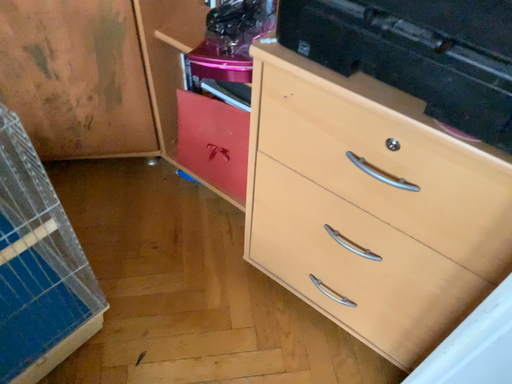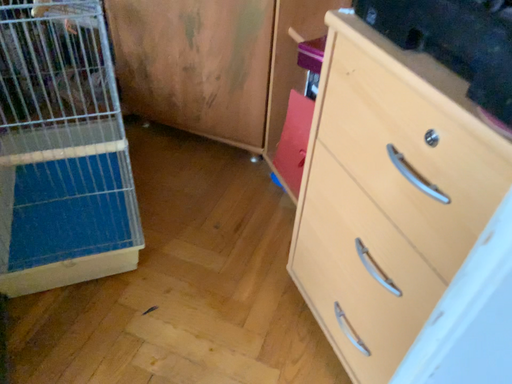
Question: How did the camera likely rotate when shooting the video?

Choices:
 (A) rotated right
 (B) rotated left

Answer: (B)